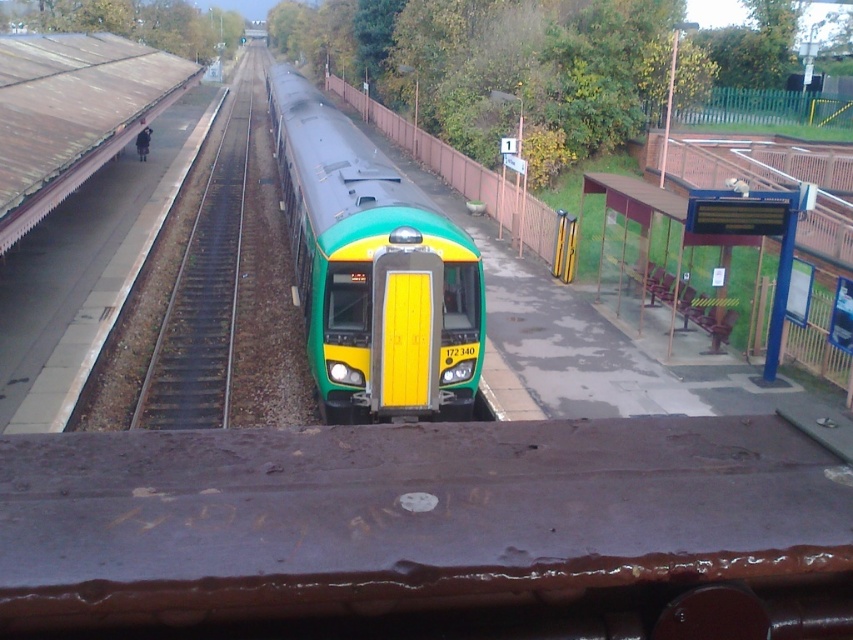
Is green matte train at center behind brown gravel train track at left?

That is False.

Between green matte train at center and brown gravel train track at left, which one appears on the right side from the viewer's perspective?

From the viewer's perspective, green matte train at center appears more on the right side.

Between point (448, 385) and point (235, 227), which one is positioned in front?

Positioned in front is point (448, 385).

Where is `green matte train at center`? The width and height of the screenshot is (853, 640). green matte train at center is located at coordinates 373,269.